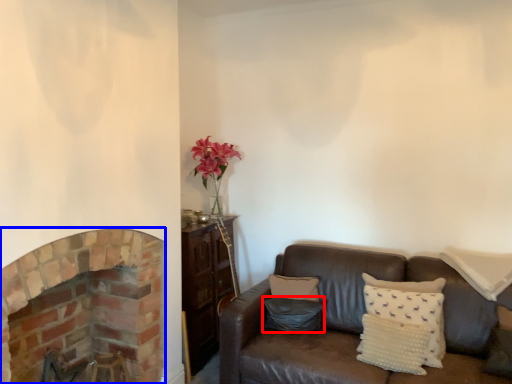
Question: Which object appears farthest to the camera in this image, pillow (highlighted by a red box) or fireplace (highlighted by a blue box)?

Choices:
 (A) pillow
 (B) fireplace

Answer: (A)